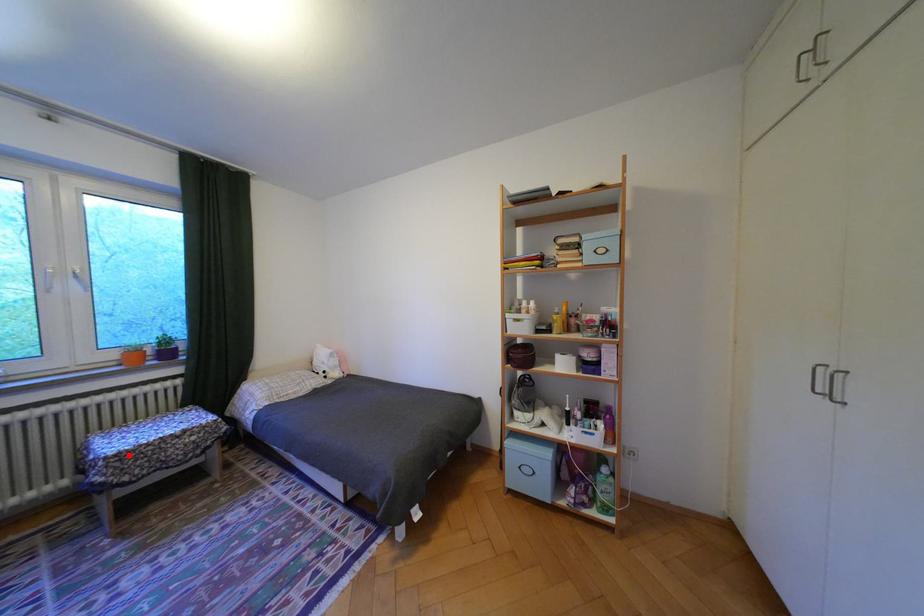
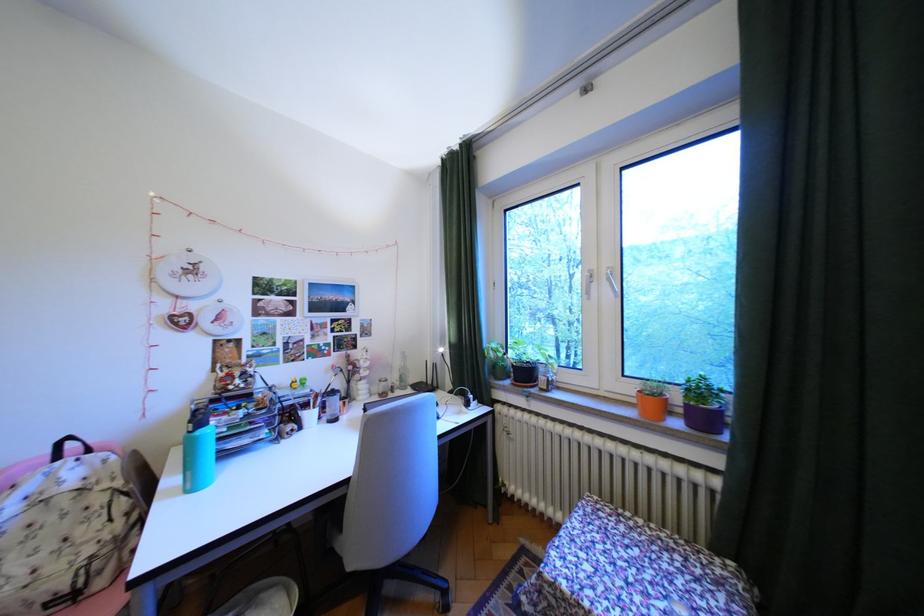
In the second image, find the point that corresponds to the highlighted location in the first image.

(564, 585)